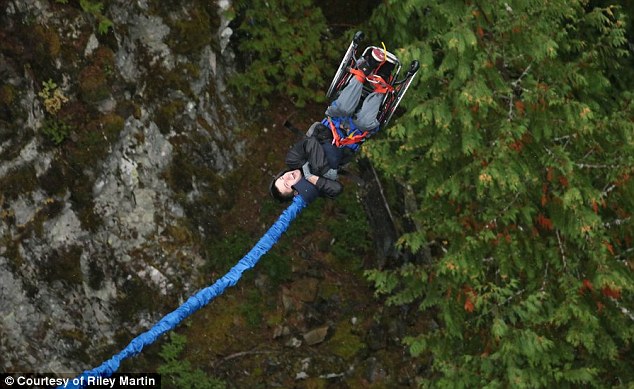
Where is `sides of chair`? This screenshot has width=634, height=389. sides of chair is located at coordinates (342, 67), (401, 88).